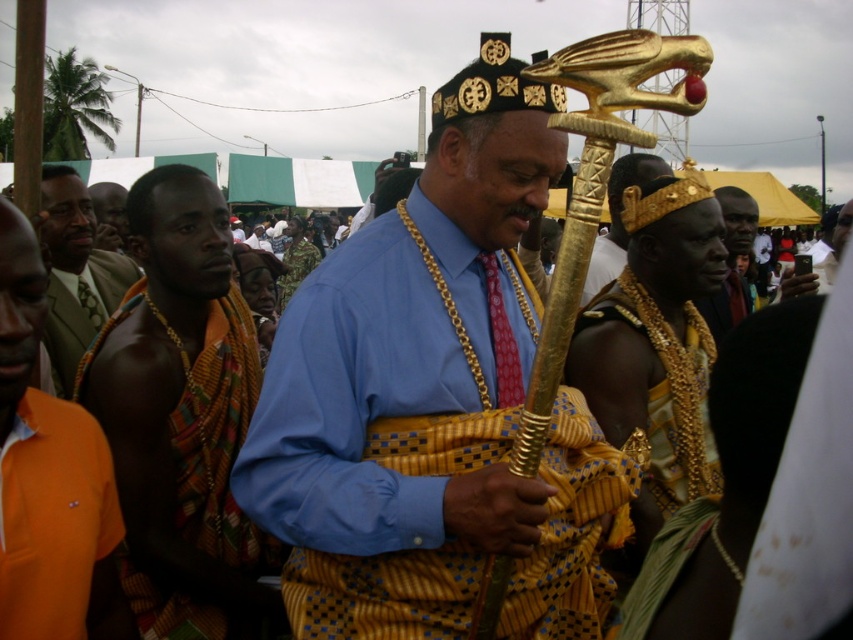
You are standing in front of the scene and want to take a photo of the central figure holding the golden staff. If you are currently at point with coordinates point (450,296), which is 12.85 feet away from the viewer, can you capture the entire scene in your camera frame?

The point (450,296) is 12.85 feet away from the viewer. Since this distance is within a typical camera frame range, you can capture the entire scene including the central figure holding the golden staff.

You are an event organizer who needs to arrange a pathway for a ceremonial procession. You have two fabrics, the textured fabric cloth at left and the orange fabric at left, placed on the same side of the stage. The procession requires a minimum of 1 meter of space between any two items along the path. Can both fabrics be placed as they are without violating the spacing requirement?

The textured fabric cloth at left is 1.11 meters from orange fabric at left. Since the required minimum space is 1 meter, the distance between them is sufficient, so yes, both fabrics can be placed as they are without violating the spacing requirement.

You are an anthropologist studying the spatial arrangement of ceremonial objects in the scene. The gold textured staff at center is located at point (433,401). What object is positioned at this coordinate?

The gold textured staff at center is positioned at point (433,401).